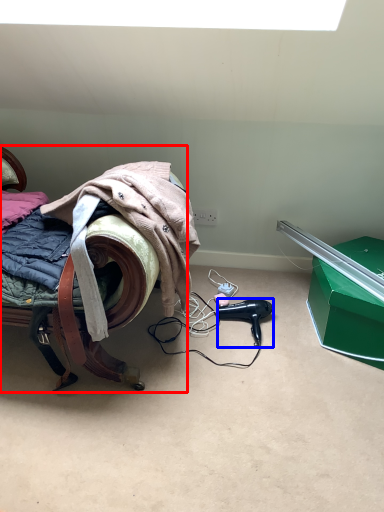
Question: Among these objects, which one is farthest to the camera, furniture (highlighted by a red box) or hair dryer (highlighted by a blue box)?

Choices:
 (A) furniture
 (B) hair dryer

Answer: (B)